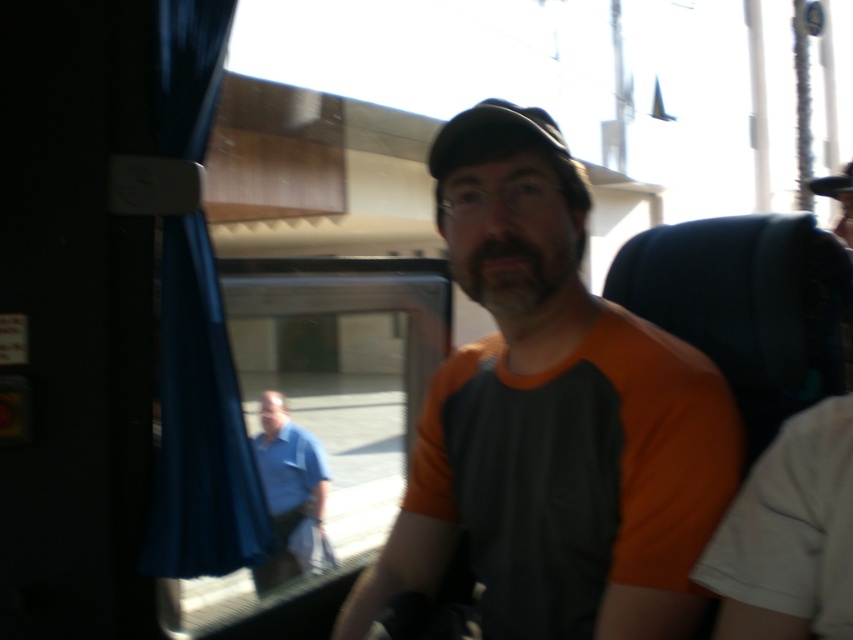
Does orange fabric shirt at center have a larger size compared to dark brown fuzzy beard at center?

Correct, orange fabric shirt at center is larger in size than dark brown fuzzy beard at center.

Who is positioned more to the right, orange fabric shirt at center or dark brown fuzzy beard at center?

From the viewer's perspective, orange fabric shirt at center appears more on the right side.

Identify the location of orange fabric shirt at center. The image size is (853, 640). (552, 417).

Identify the location of orange fabric shirt at center. Image resolution: width=853 pixels, height=640 pixels. (552, 417).

Which of these two, dark brown fuzzy beard at center or blue cotton shirt at lower left, stands taller?

Standing taller between the two is blue cotton shirt at lower left.

Who is shorter, dark brown fuzzy beard at center or blue cotton shirt at lower left?

Standing shorter between the two is dark brown fuzzy beard at center.

Find the location of a particular element. dark brown fuzzy beard at center is located at coordinates (518, 273).

Who is more forward, (538, 316) or (279, 524)?

Positioned in front is point (538, 316).

Is orange fabric shirt at center wider than blue cotton shirt at lower left?

In fact, orange fabric shirt at center might be narrower than blue cotton shirt at lower left.

Identify the location of orange fabric shirt at center. The height and width of the screenshot is (640, 853). (552, 417).

Where is `orange fabric shirt at center`? Image resolution: width=853 pixels, height=640 pixels. orange fabric shirt at center is located at coordinates (552, 417).